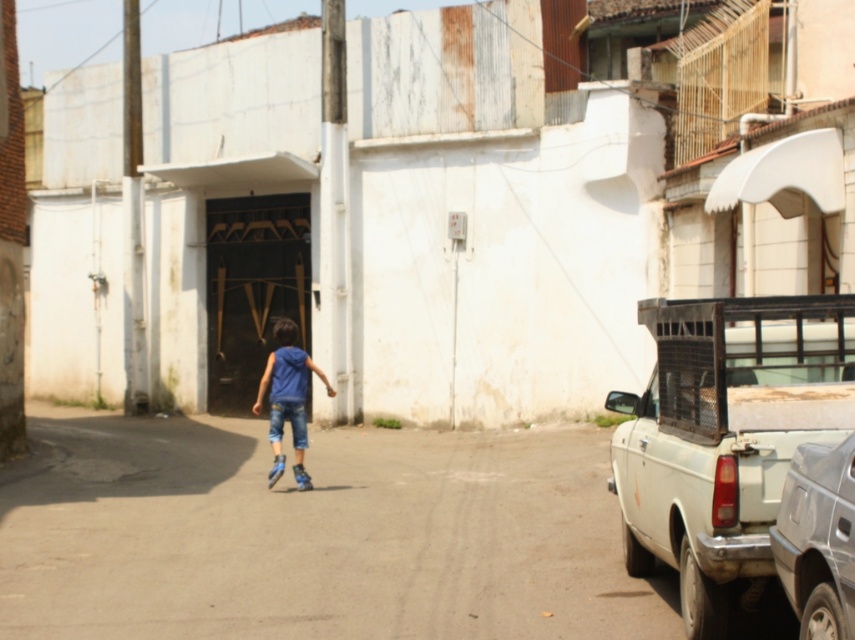
Does silver metallic car at right have a lesser height compared to denim at center?

In fact, silver metallic car at right may be taller than denim at center.

Between point (806, 488) and point (278, 438), which one is positioned in front?

Point (806, 488) is in front.

Measure the distance between silver metallic car at right and camera.

silver metallic car at right is 4.51 meters from camera.

This screenshot has height=640, width=855. Identify the location of silver metallic car at right. (818, 538).

Is white matte pickup truck at right to the right of blue denim jeans at center from the viewer's perspective?

Indeed, white matte pickup truck at right is positioned on the right side of blue denim jeans at center.

Is point (714, 456) farther from viewer compared to point (279, 369)?

No, (714, 456) is in front of (279, 369).

Locate an element on the screen. Image resolution: width=855 pixels, height=640 pixels. white matte pickup truck at right is located at coordinates (724, 436).

Can you confirm if white matte pickup truck at right is positioned above denim at center?

Yes.

Who is positioned more to the right, white matte pickup truck at right or denim at center?

white matte pickup truck at right is more to the right.

Between point (674, 467) and point (270, 424), which one is positioned behind?

The point (270, 424) is behind.

Identify the location of white matte pickup truck at right. (724, 436).